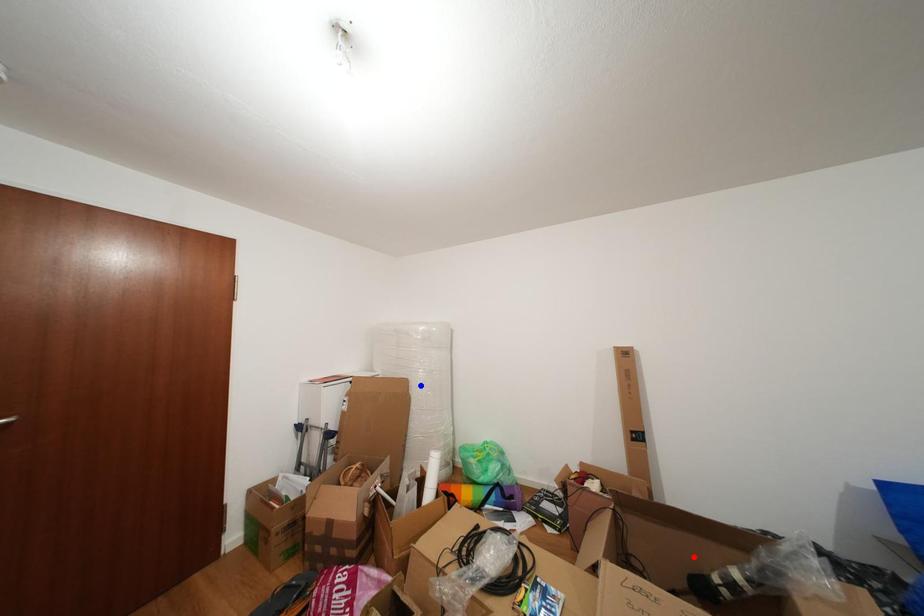
Question: Two points are marked on the image. Which point is closer to the camera?

Choices:
 (A) Blue point is closer.
 (B) Red point is closer.

Answer: (B)